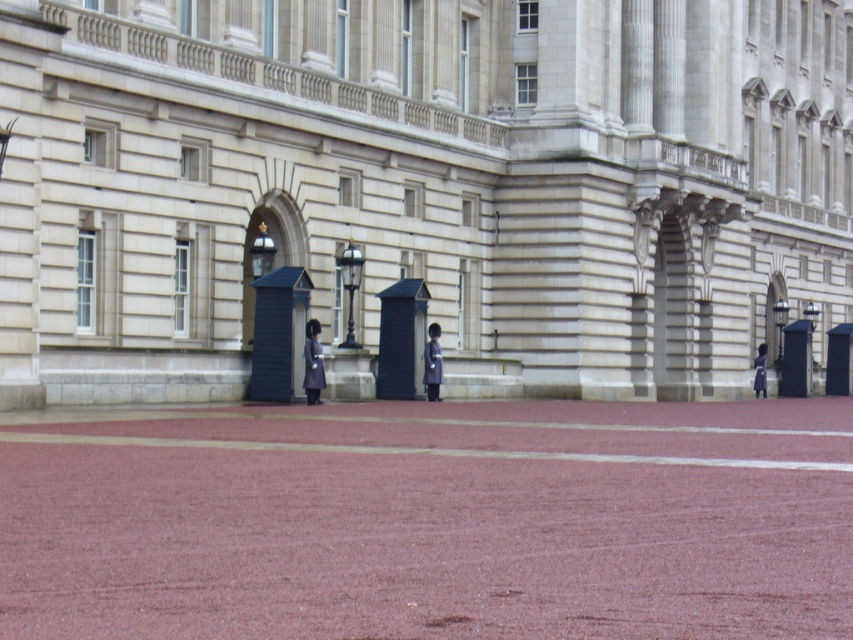
You are standing in the courtyard of the historic building. You see a point marked at coordinates (424, 180). What does this point represent?

The point at coordinates (424, 180) represents the smooth stone building at center.